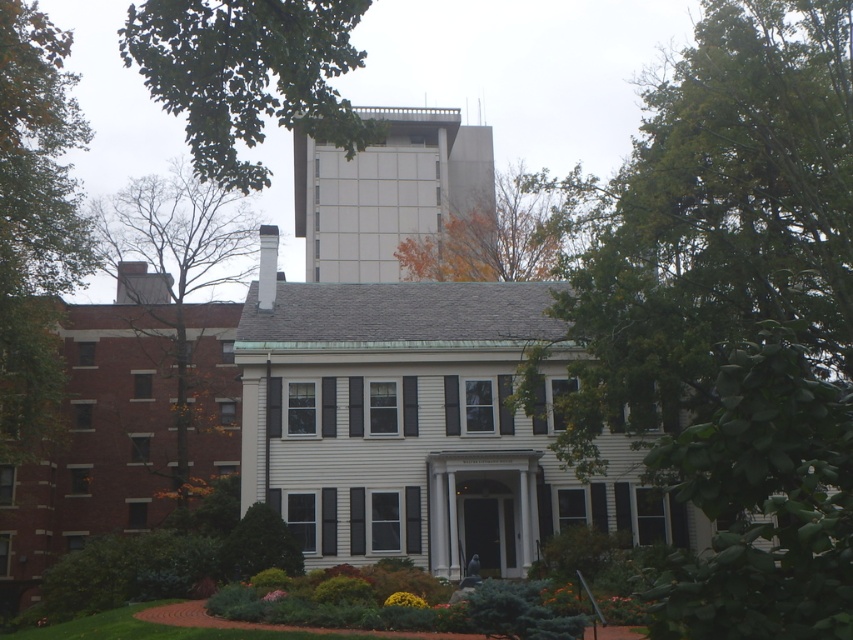
Question: Considering the real-world distances, which object is closest to the orange leafy tree at upper center?

Choices:
 (A) green leafy tree at left
 (B) green leafy tree at upper right

Answer: (B)

Question: Among these objects, which one is nearest to the camera?

Choices:
 (A) green leafy tree at upper center
 (B) green leafy tree at upper right
 (C) white smooth chimney at upper center

Answer: (B)

Question: From the image, what is the correct spatial relationship of green leafy tree at upper right in relation to green leafy tree at upper left?

Choices:
 (A) right
 (B) left

Answer: (A)

Question: Observing the image, what is the correct spatial positioning of green leafy tree at left in reference to orange leafy tree at upper center?

Choices:
 (A) below
 (B) above

Answer: (A)

Question: In this image, where is orange leafy tree at upper center located relative to white smooth chimney at upper center?

Choices:
 (A) above
 (B) below

Answer: (A)

Question: Which point is closer to the camera?

Choices:
 (A) (646, 300)
 (B) (426, 266)
 (C) (279, 35)
 (D) (219, 195)

Answer: (C)